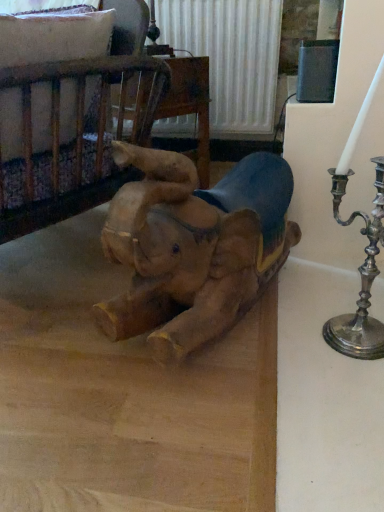
What are the coordinates of `free space that is to the left of wooden elephant at center` in the screenshot? It's located at (63, 312).